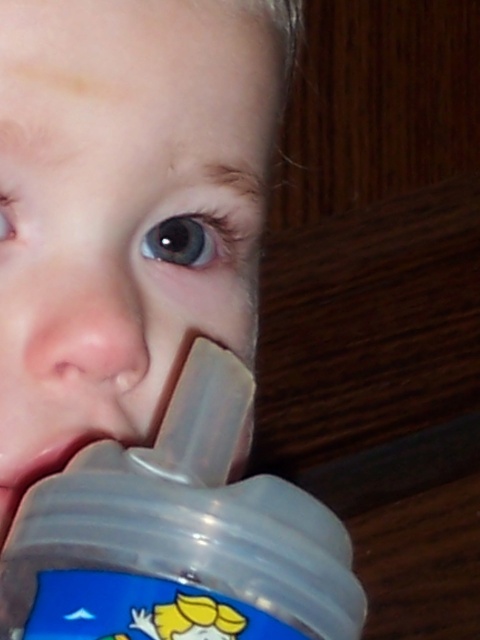
You are a photographer adjusting the focus on your camera. You notice two points in the image, point 1 at coordinates point (x=252, y=589) and point 2 at coordinates point (x=12, y=532). Which point should you focus on to ensure the foreground is sharp?

Point (x=252, y=589) is closer to the camera than point (x=12, y=532), so you should focus on point (x=252, y=589) to ensure the foreground is sharp.

In the scene shown: You are a photographer trying to capture the reflection of the baby bottle in the child mouth. Based on the scene, can you tell if the transparent plastic baby bottle at lower center is positioned in a way that its reflection would appear in the transparent plastic mouth at lower left?

The transparent plastic baby bottle at lower center is positioned over the transparent plastic mouth at lower left, so the reflection of the bottle would appear in the mouth since the bottle is directly above it.